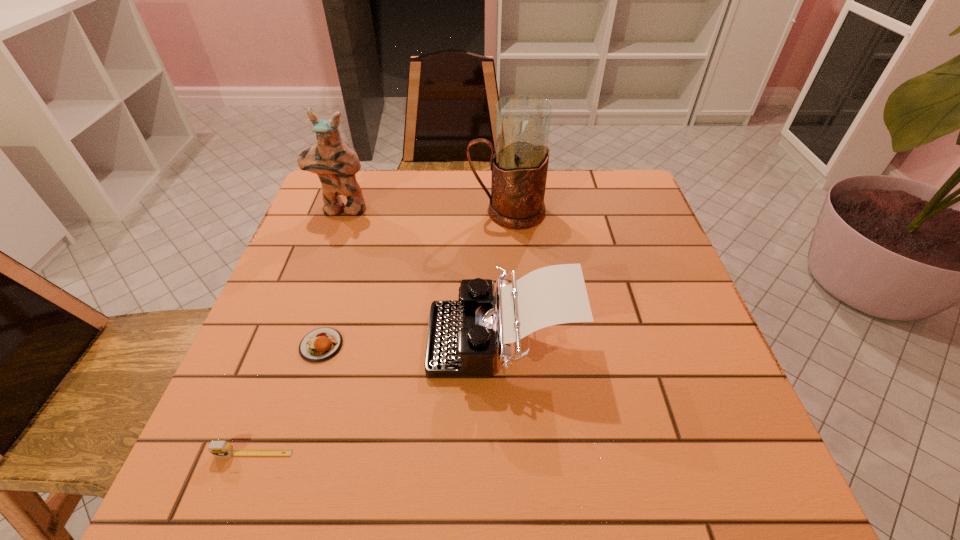
This screenshot has height=540, width=960. I want to click on empty space that is in between the pitcher and the patty (food), so click(414, 279).

The height and width of the screenshot is (540, 960). I want to click on free space between the figurine and the second shortest object, so click(298, 331).

Where is `free space between the figurine and the second shortest object`? The width and height of the screenshot is (960, 540). free space between the figurine and the second shortest object is located at coordinates (298, 331).

Find the location of a particular element. The image size is (960, 540). vacant space in between the pitcher and the shortest object is located at coordinates (414, 279).

In order to click on empty space between the shortest object and the pitcher in this screenshot , I will do `click(414, 279)`.

In order to click on free space between the typewriter and the nearest object in this screenshot , I will do `click(377, 396)`.

Locate an element on the screen. free space between the figurine and the fourth tallest object is located at coordinates (298, 331).

Locate an element on the screen. This screenshot has width=960, height=540. vacant space that's between the pitcher and the tape measure is located at coordinates (380, 333).

Locate an element on the screen. The width and height of the screenshot is (960, 540). empty space between the typewriter and the figurine is located at coordinates (421, 274).

The width and height of the screenshot is (960, 540). Find the location of `object that is the closest to the typewriter`. object that is the closest to the typewriter is located at coordinates (321, 344).